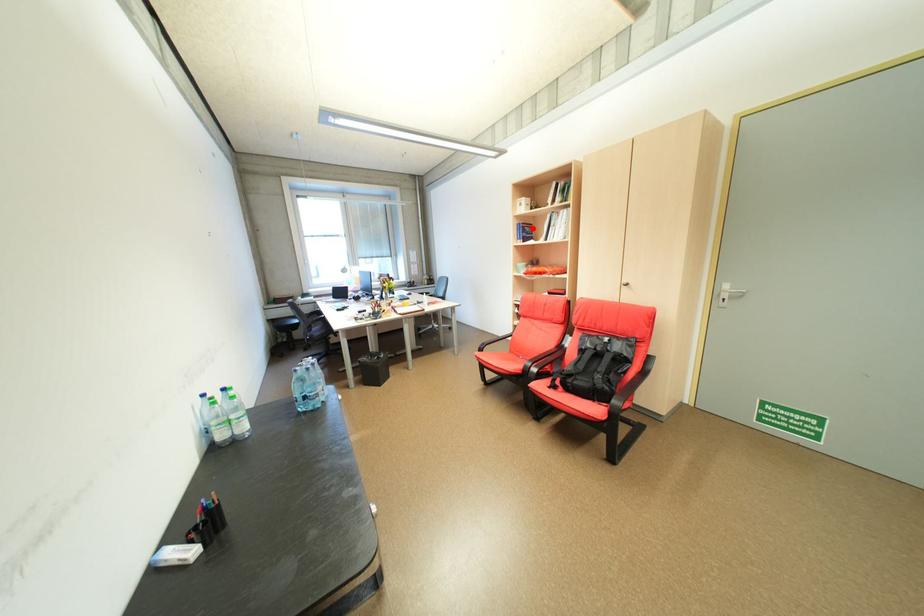
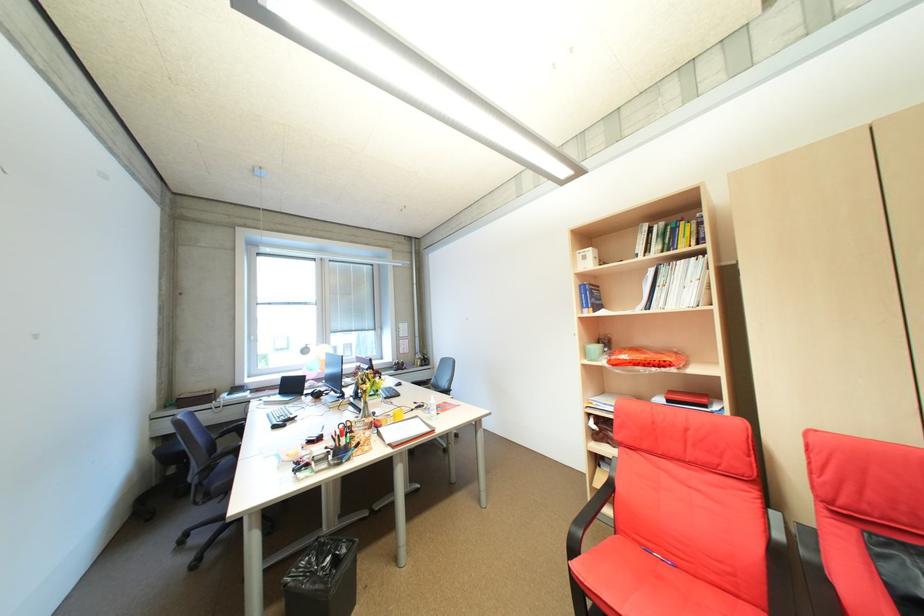
Question: I am providing you with two images of the same scene from different viewpoints. Image1 has a red point marked. In image2, the corresponding 3D location appears at what relative position? Reply with the corresponding letter.

Choices:
 (A) Closer
 (B) Farther

Answer: (B)